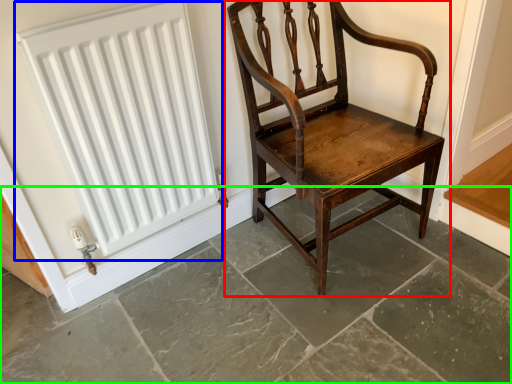
Question: Which is farther away from chair (highlighted by a red box)? radiator (highlighted by a blue box) or concrete (highlighted by a green box)?

Choices:
 (A) radiator
 (B) concrete

Answer: (A)